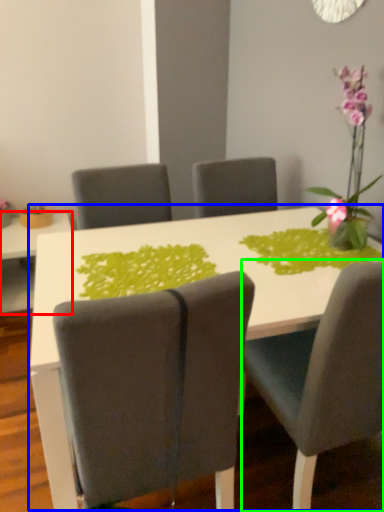
Question: Considering the real-world distances, which object is closest to table (highlighted by a red box)? table (highlighted by a blue box) or chair (highlighted by a green box).

Choices:
 (A) table
 (B) chair

Answer: (A)